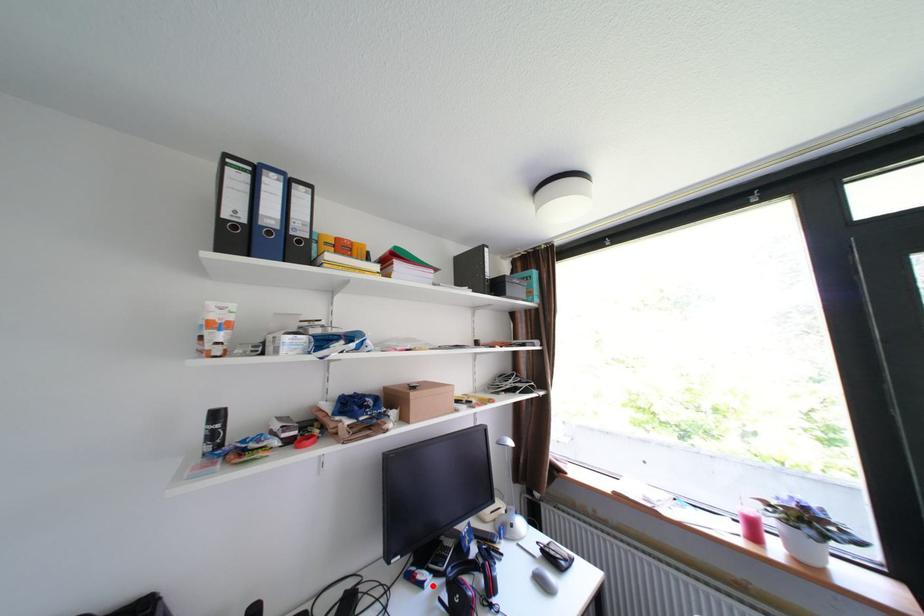
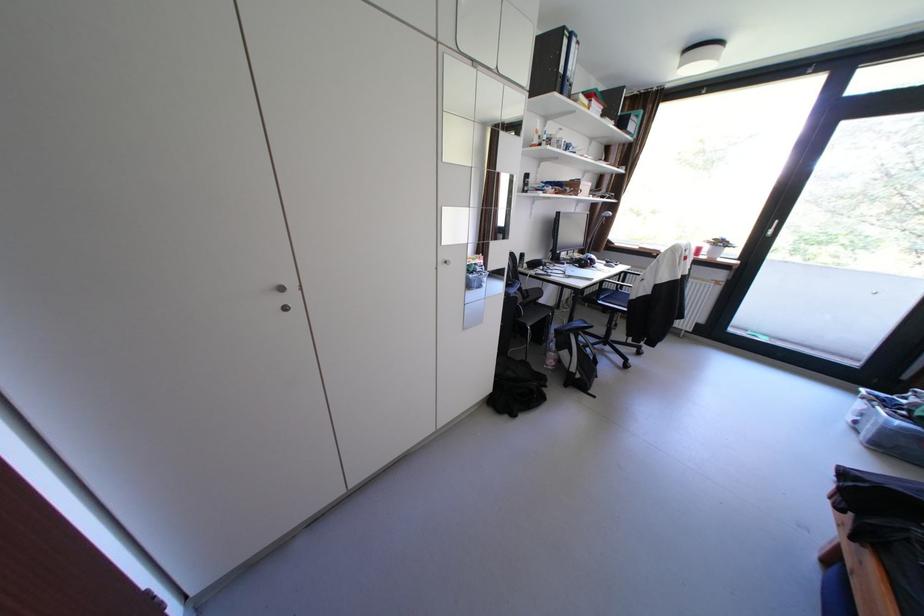
Locate, in the second image, the point that corresponds to the highlighted location in the first image.

(574, 264)